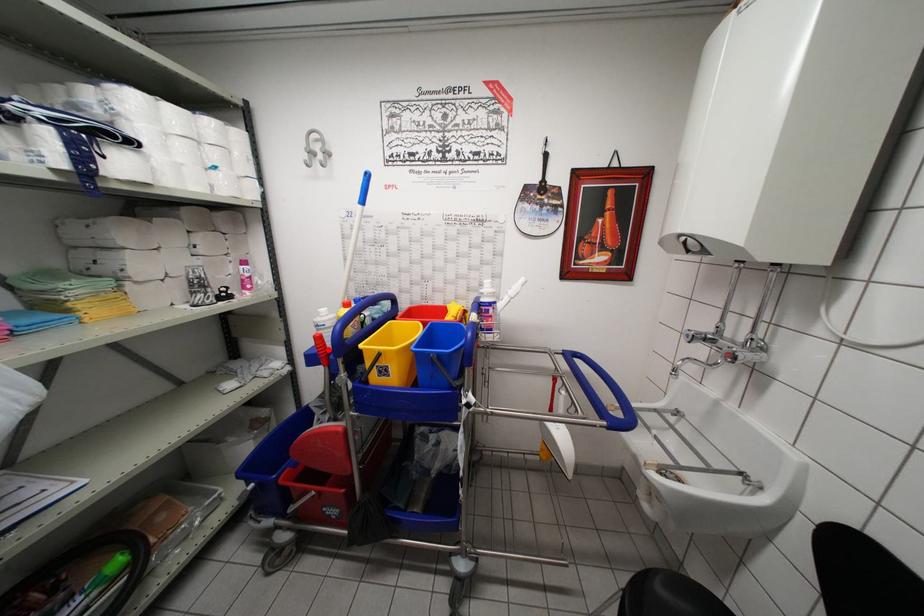
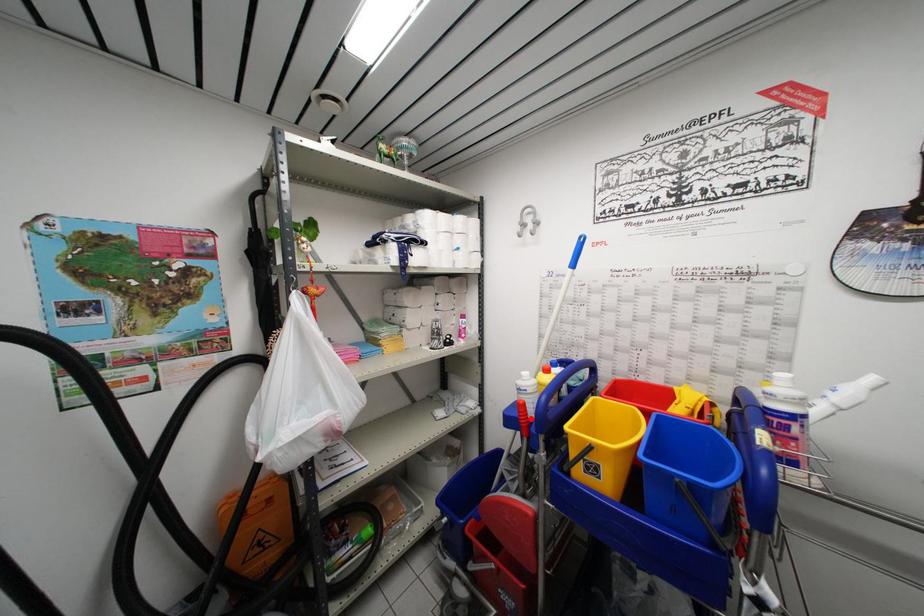
I am providing you with two images of the same scene from different viewpoints. A red point is marked on the first image and another point is marked on the second image. Is the marked point in image1 the same physical position as the marked point in image2?

Yes